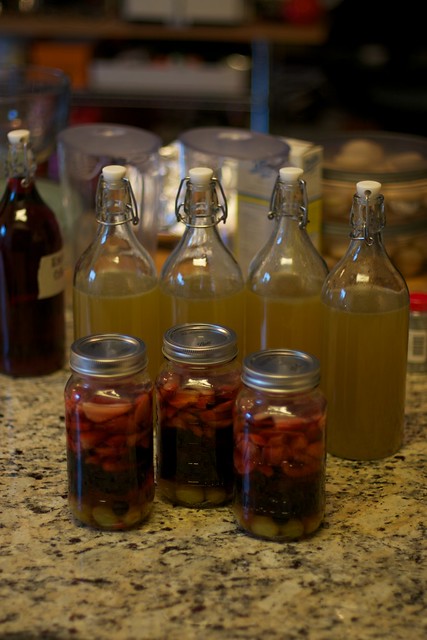
Where is `pitcher`? pitcher is located at coordinates (77, 177).